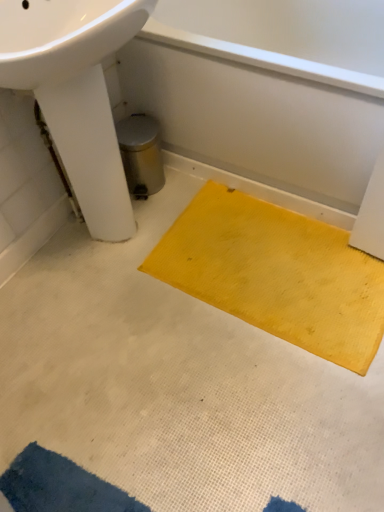
The width and height of the screenshot is (384, 512). Describe the element at coordinates (60, 486) in the screenshot. I see `blue textured mat at lower left, the 2th doormat when ordered from back to front` at that location.

What do you see at coordinates (267, 89) in the screenshot?
I see `yellow rubber mat at lower right` at bounding box center [267, 89].

Identify the location of yellow rubber mat at center, which ranks as the second doormat in front-to-back order. This screenshot has height=512, width=384. (276, 274).

Find the location of a particular element. sink in front of the blue textured mat at lower left, the 2th doormat viewed from the right is located at coordinates (76, 92).

Considering the positions of point (117, 198) and point (17, 483), is point (117, 198) closer or farther from the camera than point (17, 483)?

Point (117, 198) is farther from the camera than point (17, 483).

Which is more to the right, white glossy sink at upper left or blue textured mat at lower left, the 1th doormat when ordered from bottom to top?

Positioned to the right is blue textured mat at lower left, the 1th doormat when ordered from bottom to top.

Which of these two, white glossy sink at upper left or blue textured mat at lower left, the 1th doormat when ordered from bottom to top, is thinner?

Thinner between the two is white glossy sink at upper left.

Between blue textured mat at lower left, the 2th doormat viewed from the top, and yellow rubber mat at center, the 1th doormat viewed from the top, which one has more height?

yellow rubber mat at center, the 1th doormat viewed from the top.

Consider the image. In the image, is blue textured mat at lower left, the 2th doormat when ordered from back to front, positioned in front of or behind yellow rubber mat at center, which is the second doormat from bottom to top?

Visually, blue textured mat at lower left, the 2th doormat when ordered from back to front, is located in front of yellow rubber mat at center, which is the second doormat from bottom to top.

Is blue textured mat at lower left, the 2th doormat viewed from the top, oriented away from yellow rubber mat at center, the 1th doormat viewed from the top?

blue textured mat at lower left, the 2th doormat viewed from the top, does not have its back to yellow rubber mat at center, the 1th doormat viewed from the top.

From a real-world perspective, is blue textured mat at lower left, the 1th doormat when ordered from front to back, above or below yellow rubber mat at center, arranged as the 1th doormat when viewed from the right?

blue textured mat at lower left, the 1th doormat when ordered from front to back, is situated lower than yellow rubber mat at center, arranged as the 1th doormat when viewed from the right, in the real world.

Considering the relative sizes of yellow rubber mat at center, the 1th doormat viewed from the top, and yellow rubber mat at lower right in the image provided, is yellow rubber mat at center, the 1th doormat viewed from the top, taller than yellow rubber mat at lower right?

No.

From the image's perspective, is yellow rubber mat at center, the second doormat from the left, below yellow rubber mat at lower right?

Indeed, from the image's perspective, yellow rubber mat at center, the second doormat from the left, is shown beneath yellow rubber mat at lower right.

Is yellow rubber mat at center, the 1th doormat viewed from the top, positioned with its back to yellow rubber mat at lower right?

Yes, yellow rubber mat at center, the 1th doormat viewed from the top, is positioned with its back facing yellow rubber mat at lower right.

Which point is more forward, (199, 236) or (165, 140)?

Positioned in front is point (199, 236).

Considering the sizes of objects white glossy sink at upper left and yellow rubber mat at center, arranged as the 1th doormat when viewed from the right, in the image provided, who is taller, white glossy sink at upper left or yellow rubber mat at center, arranged as the 1th doormat when viewed from the right,?

Standing taller between the two is white glossy sink at upper left.

Can you tell me how much white glossy sink at upper left and yellow rubber mat at center, the second doormat from the left, differ in facing direction?

88.7 degrees.

Considering the relative sizes of white glossy sink at upper left and yellow rubber mat at center, the second doormat from the left, in the image provided, is white glossy sink at upper left bigger than yellow rubber mat at center, the second doormat from the left,?

Indeed, white glossy sink at upper left has a larger size compared to yellow rubber mat at center, the second doormat from the left.

From a real-world perspective, relative to yellow rubber mat at center, which ranks as the second doormat in front-to-back order, is white glossy sink at upper left vertically above or below?

In terms of real-world spatial position, white glossy sink at upper left is above yellow rubber mat at center, which ranks as the second doormat in front-to-back order.

Which of these two, yellow rubber mat at center, the 1th doormat in the back-to-front sequence, or white glossy sink at upper left, stands taller?

With more height is white glossy sink at upper left.

Which point is more forward, (297, 287) or (97, 230)?

Point (297, 287)

Based on their sizes in the image, would you say yellow rubber mat at center, which is the second doormat from bottom to top, is bigger or smaller than white glossy sink at upper left?

In the image, yellow rubber mat at center, which is the second doormat from bottom to top, appears to be smaller than white glossy sink at upper left.

In the scene shown: Which is more to the left, yellow rubber mat at lower right or yellow rubber mat at center, the second doormat from the left?

From the viewer's perspective, yellow rubber mat at center, the second doormat from the left, appears more on the left side.

Identify the location of doormat located behind the yellow rubber mat at lower right. (276, 274).

Is yellow rubber mat at lower right far away from yellow rubber mat at center, which is the second doormat from bottom to top?

No, yellow rubber mat at lower right is not far from yellow rubber mat at center, which is the second doormat from bottom to top.

Could yellow rubber mat at center, arranged as the 1th doormat when viewed from the right, be considered to be inside yellow rubber mat at lower right?

No, yellow rubber mat at center, arranged as the 1th doormat when viewed from the right, is located outside of yellow rubber mat at lower right.

Consider the image. From a real-world perspective, is yellow rubber mat at center, which ranks as the second doormat in front-to-back order, on top of blue textured mat at lower left, the 2th doormat when ordered from back to front?

Yes, from a real-world perspective, yellow rubber mat at center, which ranks as the second doormat in front-to-back order, is on top of blue textured mat at lower left, the 2th doormat when ordered from back to front.

From the image's perspective, which one is positioned lower, yellow rubber mat at center, the 1th doormat in the back-to-front sequence, or blue textured mat at lower left, the 2th doormat viewed from the top?

blue textured mat at lower left, the 2th doormat viewed from the top, appears lower in the image.

You are a GUI agent. You are given a task and a screenshot of the screen. Output one action in this format:
    pyautogui.click(x=<x>, y=<y>)
    Task: Click on the doormat that is in front of the yellow rubber mat at center, the 1th doormat in the back-to-front sequence
    The width and height of the screenshot is (384, 512).
    Given the screenshot: What is the action you would take?
    pyautogui.click(x=60, y=486)

Between yellow rubber mat at center, which ranks as the second doormat in front-to-back order, and blue textured mat at lower left, the 2th doormat when ordered from back to front, which one has less height?

With less height is blue textured mat at lower left, the 2th doormat when ordered from back to front.

Which doormat is the 1st one when counting from the right side of the white glossy sink at upper left? Please provide its 2D coordinates.

[(60, 486)]

Where is `doormat below the yellow rubber mat at center, the 1th doormat in the back-to-front sequence (from a real-world perspective)`? This screenshot has width=384, height=512. doormat below the yellow rubber mat at center, the 1th doormat in the back-to-front sequence (from a real-world perspective) is located at coordinates (60, 486).

Estimate the real-world distances between objects in this image. Which object is further from white glossy sink at upper left, blue textured mat at lower left, the 1th doormat when ordered from left to right, or yellow rubber mat at lower right?

Based on the image, blue textured mat at lower left, the 1th doormat when ordered from left to right, appears to be further to white glossy sink at upper left.

Estimate the real-world distances between objects in this image. Which object is closer to blue textured mat at lower left, the 2th doormat viewed from the right, yellow rubber mat at center, the 1th doormat viewed from the top, or yellow rubber mat at lower right?

yellow rubber mat at center, the 1th doormat viewed from the top, lies closer to blue textured mat at lower left, the 2th doormat viewed from the right, than the other object.

Estimate the real-world distances between objects in this image. Which object is further from yellow rubber mat at lower right, yellow rubber mat at center, arranged as the 1th doormat when viewed from the right, or blue textured mat at lower left, the 2th doormat when ordered from back to front?

blue textured mat at lower left, the 2th doormat when ordered from back to front, lies further to yellow rubber mat at lower right than the other object.

Looking at the image, which one is located closer to blue textured mat at lower left, the 1th doormat when ordered from bottom to top, yellow rubber mat at center, the 1th doormat viewed from the top, or white glossy sink at upper left?

yellow rubber mat at center, the 1th doormat viewed from the top, lies closer to blue textured mat at lower left, the 1th doormat when ordered from bottom to top, than the other object.

When comparing their distances from white glossy sink at upper left, does yellow rubber mat at center, arranged as the 1th doormat when viewed from the right, or yellow rubber mat at lower right seem further?

yellow rubber mat at center, arranged as the 1th doormat when viewed from the right, lies further to white glossy sink at upper left than the other object.

When comparing their distances from yellow rubber mat at lower right, does blue textured mat at lower left, the 1th doormat when ordered from front to back, or yellow rubber mat at center, which ranks as the second doormat in front-to-back order, seem closer?

Among the two, yellow rubber mat at center, which ranks as the second doormat in front-to-back order, is located nearer to yellow rubber mat at lower right.

In the scene shown: Which object lies nearer to the anchor point yellow rubber mat at lower right, yellow rubber mat at center, the 1th doormat in the back-to-front sequence, or white glossy sink at upper left?

yellow rubber mat at center, the 1th doormat in the back-to-front sequence, is positioned closer to the anchor yellow rubber mat at lower right.

When comparing their distances from yellow rubber mat at lower right, does white glossy sink at upper left or yellow rubber mat at center, the 1th doormat viewed from the top, seem closer?

yellow rubber mat at center, the 1th doormat viewed from the top.

Where is `doormat that lies between yellow rubber mat at lower right and blue textured mat at lower left, the 2th doormat viewed from the top, from top to bottom`? The height and width of the screenshot is (512, 384). doormat that lies between yellow rubber mat at lower right and blue textured mat at lower left, the 2th doormat viewed from the top, from top to bottom is located at coordinates (276, 274).

This screenshot has height=512, width=384. Identify the location of sink between yellow rubber mat at lower right and yellow rubber mat at center, which is the second doormat from bottom to top, in the vertical direction. (76, 92).

The height and width of the screenshot is (512, 384). I want to click on sink between yellow rubber mat at lower right and blue textured mat at lower left, the 1th doormat when ordered from left to right, in the vertical direction, so (x=76, y=92).

Locate an element on the screen. doormat between white glossy sink at upper left and blue textured mat at lower left, the 1th doormat when ordered from left to right, from top to bottom is located at coordinates (276, 274).